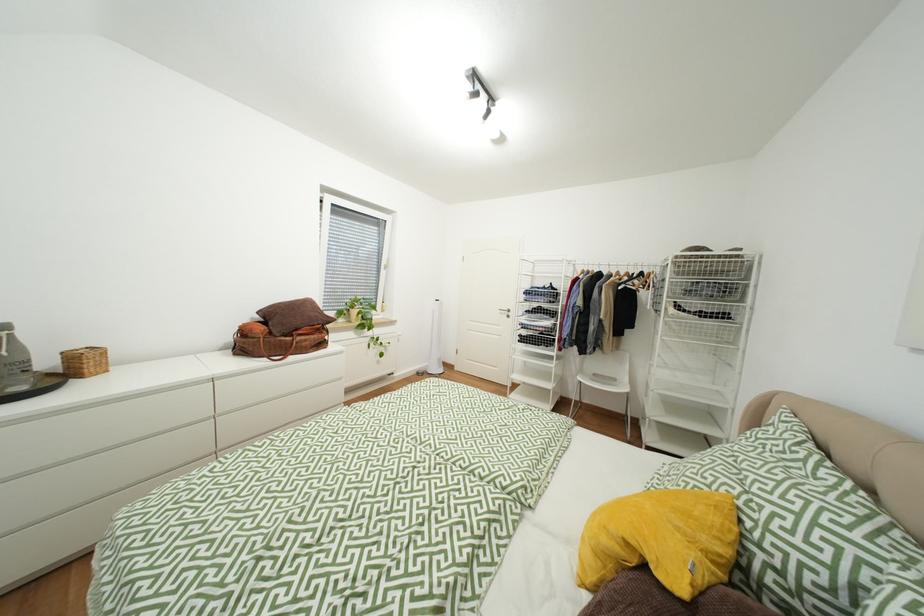
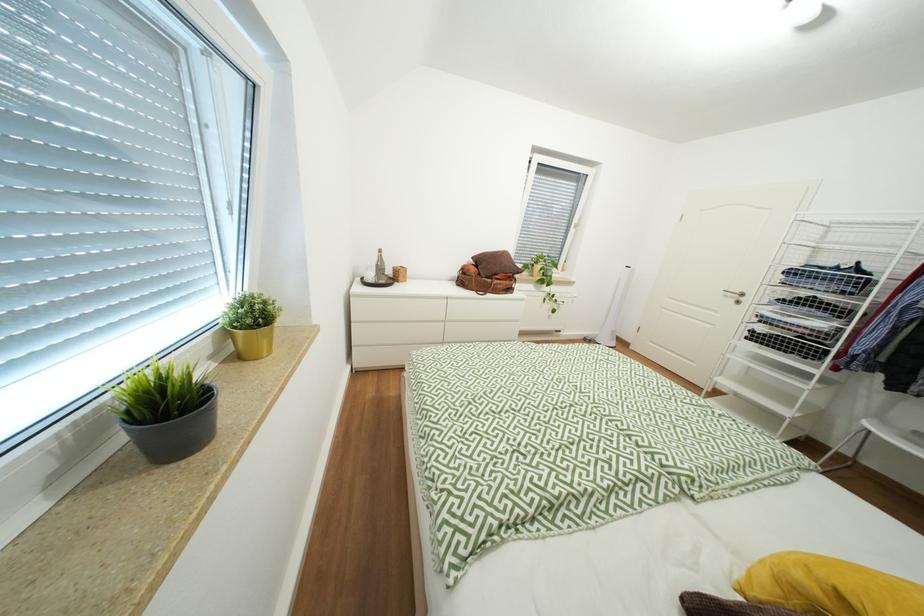
Question: How did the camera likely rotate?

Choices:
 (A) Left
 (B) Right
 (C) Up
 (D) Down

Answer: (A)